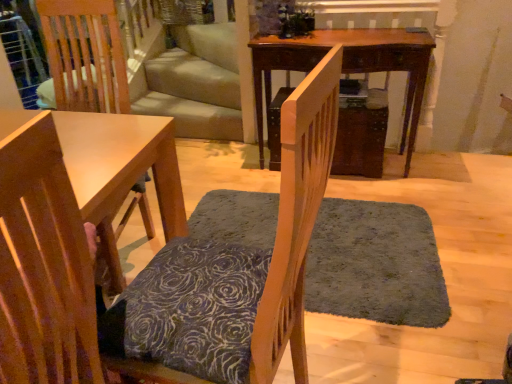
Locate an element on the screen. vacant space to the right of dark gray shaggy rug at center is located at coordinates click(x=466, y=232).